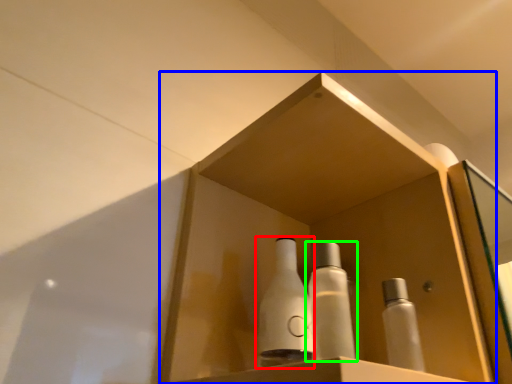
Question: Estimate the real-world distances between objects in this image. Which object is farther from bottle (highlighted by a red box), shelf (highlighted by a blue box) or bottle (highlighted by a green box)?

Choices:
 (A) shelf
 (B) bottle

Answer: (A)